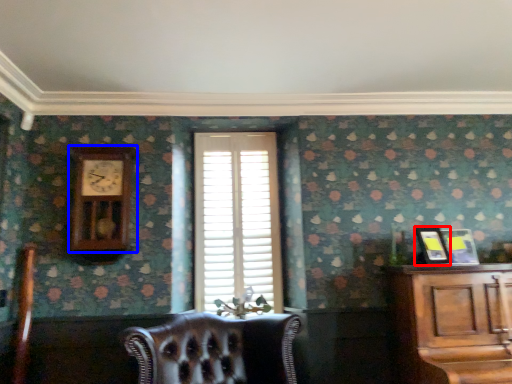
Question: Which object appears closest to the camera in this image, picture frame (highlighted by a red box) or clock (highlighted by a blue box)?

Choices:
 (A) picture frame
 (B) clock

Answer: (A)